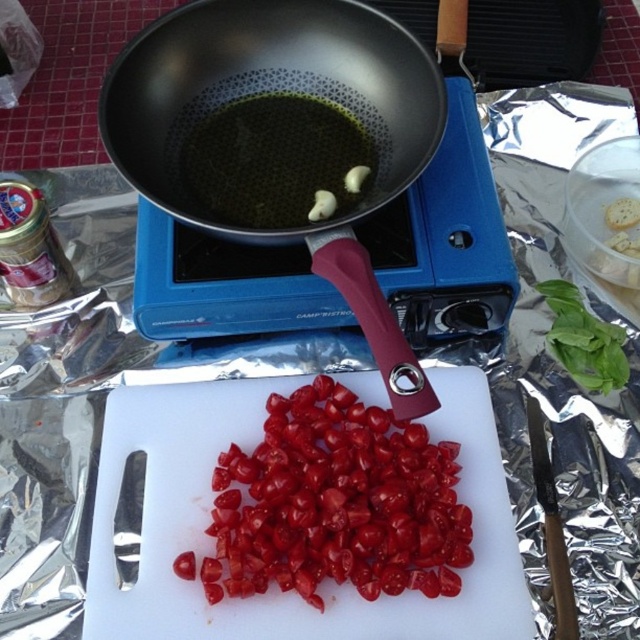
Does point (305, 17) lie in front of point (420, 432)?

No, (305, 17) is behind (420, 432).

What do you see at coordinates (282, 134) in the screenshot? I see `black non-stick wok at center` at bounding box center [282, 134].

Does point (184, 90) come behind point (246, 472)?

Yes, it is.

This screenshot has height=640, width=640. What are the coordinates of `black non-stick wok at center` in the screenshot? It's located at (282, 134).